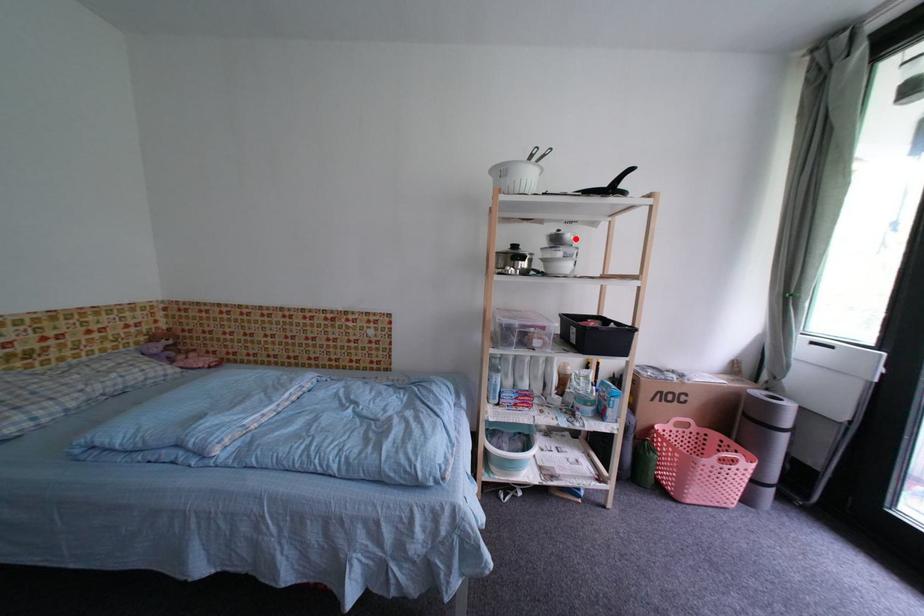
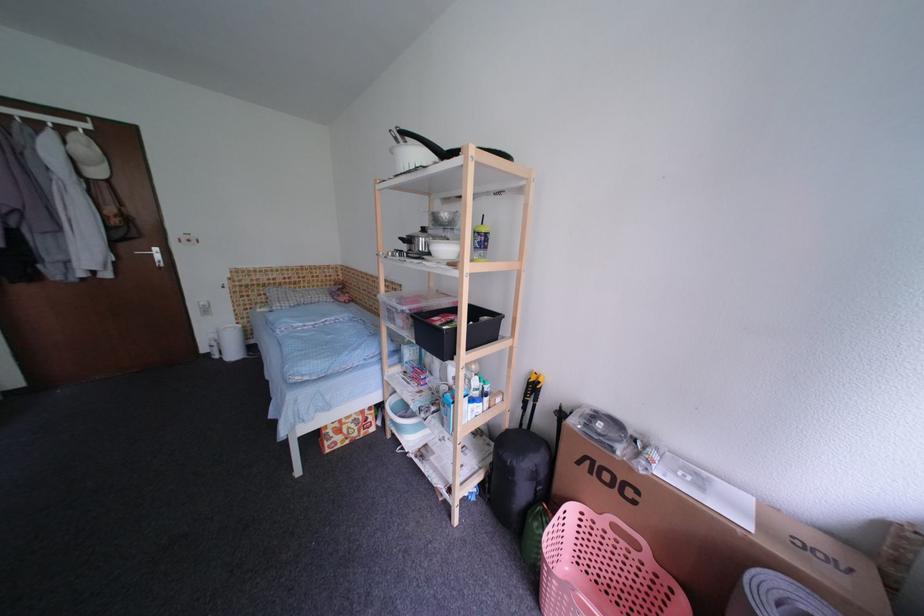
The point at the highlighted location is marked in the first image. Where is the corresponding point in the second image?

(453, 217)